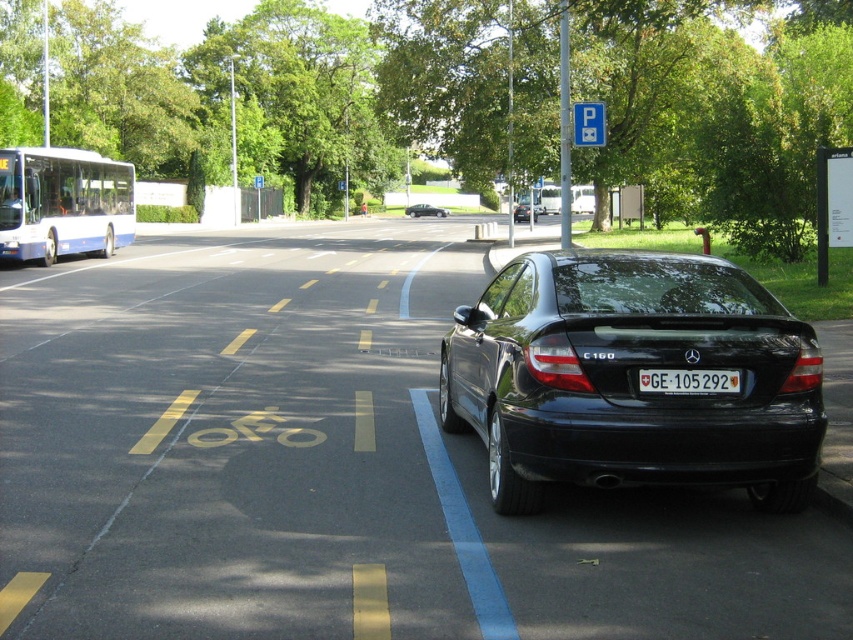
Question: Estimate the real-world distances between objects in this image. Which object is closer to the white plastic license plate at center?

Choices:
 (A) black glossy car at center
 (B) shiny black sedan at center
 (C) white matte bus at upper left
 (D) black glossy sedan at center

Answer: (A)

Question: Which object is positioned closest to the black glossy sedan at center?

Choices:
 (A) white matte bus at upper left
 (B) white plastic license plate at center
 (C) shiny black sedan at center

Answer: (C)

Question: Where is black glossy car at center located in relation to white plastic license plate at center in the image?

Choices:
 (A) right
 (B) left

Answer: (B)

Question: Is white plastic license plate at center to the left of shiny black sedan at center from the viewer's perspective?

Choices:
 (A) yes
 (B) no

Answer: (B)

Question: Is the position of black glossy car at center less distant than that of white matte bus at upper left?

Choices:
 (A) yes
 (B) no

Answer: (A)

Question: Which point is farther to the camera?

Choices:
 (A) black glossy car at center
 (B) black glossy sedan at center
 (C) shiny black sedan at center
 (D) white plastic license plate at center

Answer: (C)